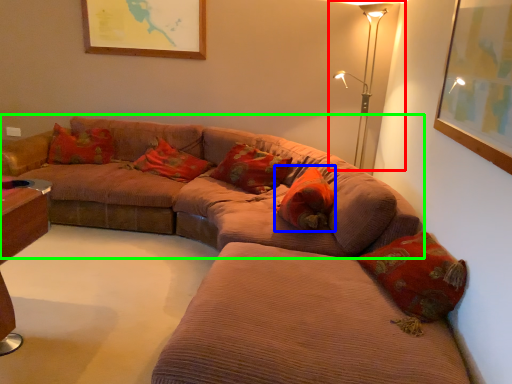
Question: Which object is positioned farthest from table lamp (highlighted by a red box)? Select from pillow (highlighted by a blue box) and studio couch (highlighted by a green box).

Choices:
 (A) pillow
 (B) studio couch

Answer: (B)